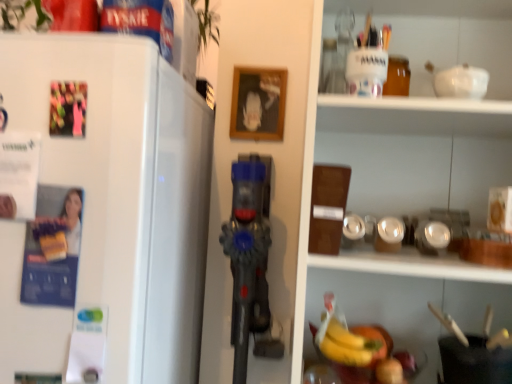
Question: Should I look upward or downward to see yellow matte bananas at lower center?

Choices:
 (A) up
 (B) down

Answer: (B)

Question: Can you confirm if white matte refrigerator at left is positioned to the right of yellow matte bananas at lower center?

Choices:
 (A) yes
 (B) no

Answer: (B)

Question: Can you confirm if white matte refrigerator at left is wider than yellow matte bananas at lower center?

Choices:
 (A) yes
 (B) no

Answer: (A)

Question: From the image's perspective, is white matte refrigerator at left on top of yellow matte bananas at lower center?

Choices:
 (A) no
 (B) yes

Answer: (B)

Question: Is white matte refrigerator at left positioned with its back to yellow matte bananas at lower center?

Choices:
 (A) no
 (B) yes

Answer: (A)

Question: Is white matte refrigerator at left touching yellow matte bananas at lower center?

Choices:
 (A) no
 (B) yes

Answer: (A)

Question: Considering the relative positions of white matte refrigerator at left and yellow matte bananas at lower center in the image provided, is white matte refrigerator at left in front of yellow matte bananas at lower center?

Choices:
 (A) yes
 (B) no

Answer: (A)

Question: Is yellow matte bananas at lower center smaller than white matte refrigerator at left?

Choices:
 (A) no
 (B) yes

Answer: (B)

Question: Does yellow matte bananas at lower center appear on the right side of white matte refrigerator at left?

Choices:
 (A) no
 (B) yes

Answer: (B)

Question: Can you confirm if yellow matte bananas at lower center is wider than white matte refrigerator at left?

Choices:
 (A) yes
 (B) no

Answer: (B)

Question: Is yellow matte bananas at lower center outside white matte refrigerator at left?

Choices:
 (A) no
 (B) yes

Answer: (B)

Question: From a real-world perspective, does yellow matte bananas at lower center sit lower than white matte refrigerator at left?

Choices:
 (A) no
 (B) yes

Answer: (B)

Question: Is yellow matte bananas at lower center not close to white matte refrigerator at left?

Choices:
 (A) no
 (B) yes

Answer: (A)

Question: Visually, is white matte refrigerator at left positioned to the left or to the right of yellow matte bananas at lower center?

Choices:
 (A) left
 (B) right

Answer: (A)